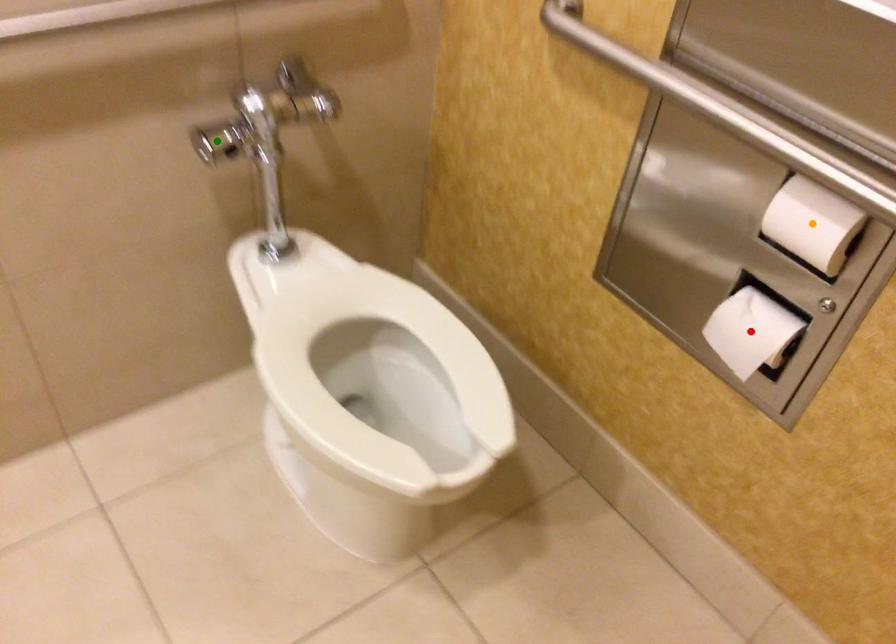
In the scene shown: Order these from nearest to farthest:
red point, green point, orange point

orange point, red point, green point